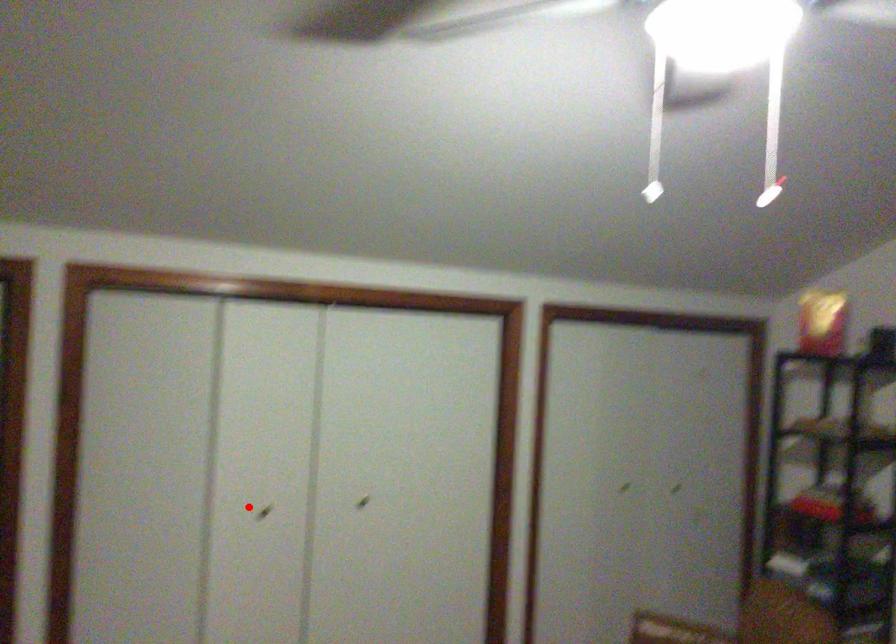
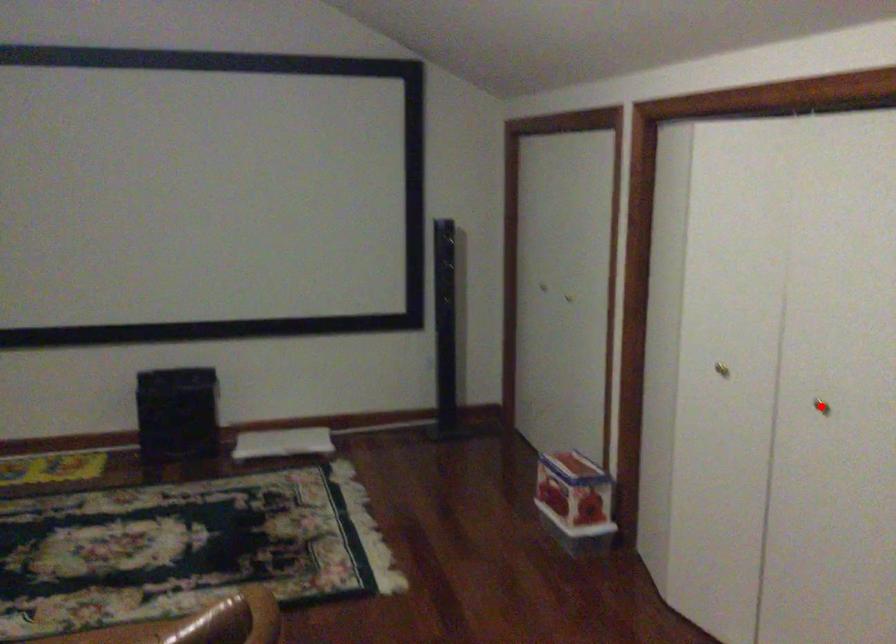
I am providing you with two images of the same scene from different viewpoints. A red point is marked on the first image and another point is marked on the second image. Is the red point in image1 aligned with the point shown in image2?

No